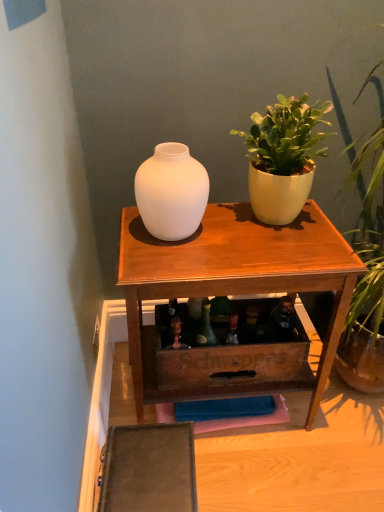
Locate an element on the screen. vacant area that lies between matte yellow pot at upper right and matte white vase at center is located at coordinates click(228, 230).